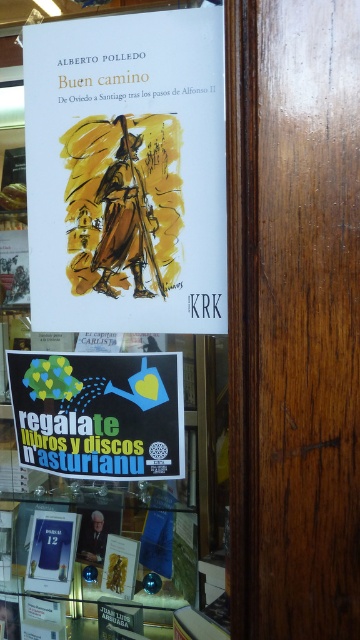
Between matte yellow poster at upper center and black paper poster at lower center, which one appears on the right side from the viewer's perspective?

matte yellow poster at upper center is more to the right.

Between matte yellow poster at upper center and black paper poster at lower center, which one is positioned higher?

matte yellow poster at upper center is above.

Image resolution: width=360 pixels, height=640 pixels. In order to click on matte yellow poster at upper center in this screenshot , I will do `click(127, 172)`.

Where is `matte yellow poster at upper center`? The height and width of the screenshot is (640, 360). matte yellow poster at upper center is located at coordinates (127, 172).

Is white paper book at upper center to the right of matte yellow poster at upper center from the viewer's perspective?

No, white paper book at upper center is not to the right of matte yellow poster at upper center.

Is point (106, 163) less distant than point (105, 269)?

Yes, point (106, 163) is closer to viewer.

Locate an element on the screen. The width and height of the screenshot is (360, 640). white paper book at upper center is located at coordinates (114, 292).

Is point (24, 445) in front of point (135, 426)?

No.

The width and height of the screenshot is (360, 640). What do you see at coordinates (114, 292) in the screenshot?
I see `white paper book at upper center` at bounding box center [114, 292].

Identify the location of white paper book at upper center. (114, 292).